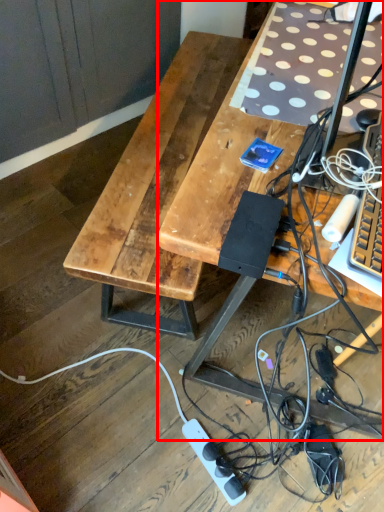
Question: From the image's perspective, what is the correct spatial positioning of desk (annotated by the red box) in reference to power outlet?

Choices:
 (A) below
 (B) above

Answer: (B)